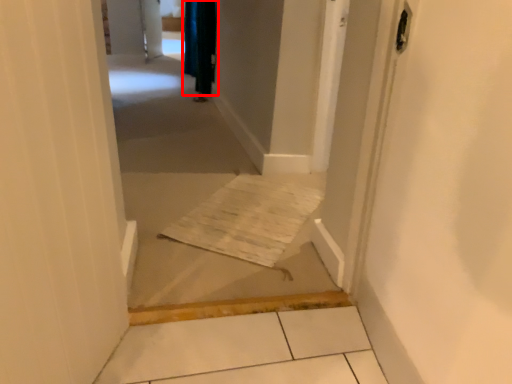
Question: From the image, what is the correct spatial relationship of curtain (annotated by the red box) in relation to corridor?

Choices:
 (A) right
 (B) left

Answer: (B)